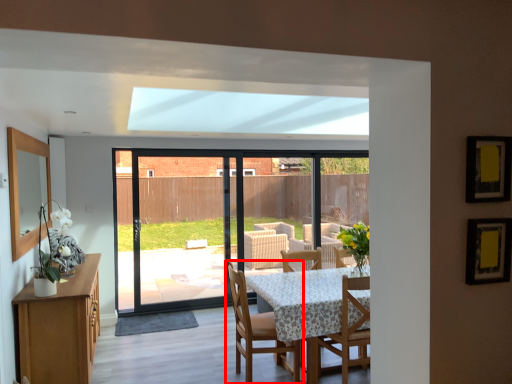
Question: Observing the image, what is the correct spatial positioning of chair (annotated by the red box) in reference to chair?

Choices:
 (A) left
 (B) right

Answer: (A)